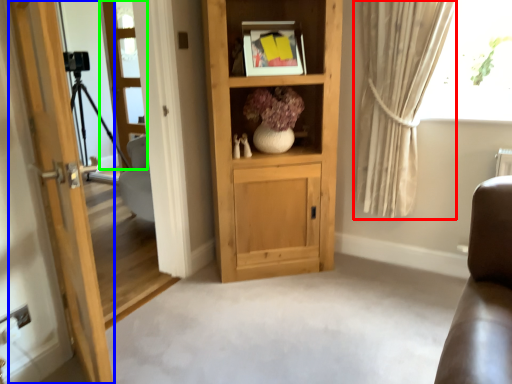
Question: Based on their relative distances, which object is nearer to curtain (highlighted by a red box)? Choose from door (highlighted by a blue box) and screen door (highlighted by a green box).

Choices:
 (A) door
 (B) screen door

Answer: (A)